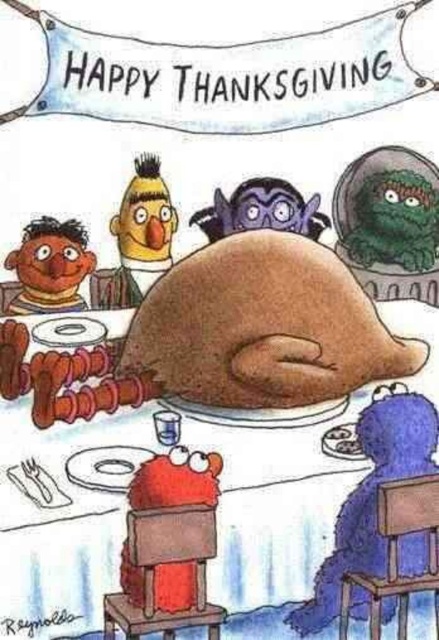
Does blue furry cookie monster at lower right appear over brown matte ernie at lower left?

No.

Who is lower down, blue furry cookie monster at lower right or brown matte ernie at lower left?

blue furry cookie monster at lower right is lower down.

The height and width of the screenshot is (640, 439). I want to click on blue furry cookie monster at lower right, so click(x=371, y=499).

Consider the image. Does blue furry cookie monster at lower right appear over purple matte bat at upper center?

Incorrect, blue furry cookie monster at lower right is not positioned above purple matte bat at upper center.

Is blue furry cookie monster at lower right wider than purple matte bat at upper center?

Indeed, blue furry cookie monster at lower right has a greater width compared to purple matte bat at upper center.

Identify the location of blue furry cookie monster at lower right. (371, 499).

Is brown matte turkey at center positioned in front of brown matte ernie at lower left?

Yes, it is.

Does brown matte turkey at center have a smaller size compared to brown matte ernie at lower left?

No.

Who is more forward, (x=247, y=259) or (x=64, y=307)?

Result: Positioned in front is point (x=247, y=259).

Locate an element on the screen. This screenshot has height=640, width=439. brown matte turkey at center is located at coordinates (262, 326).